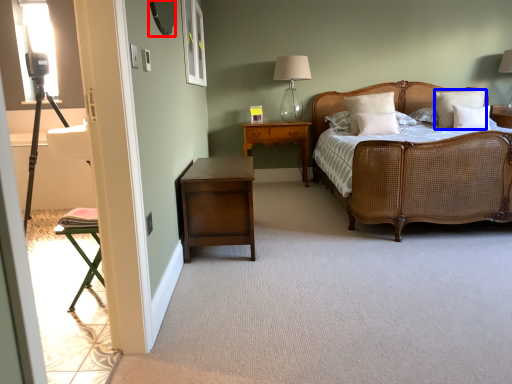
Question: Which point is further to the camera, mirror (highlighted by a red box) or pillow (highlighted by a blue box)?

Choices:
 (A) mirror
 (B) pillow

Answer: (B)